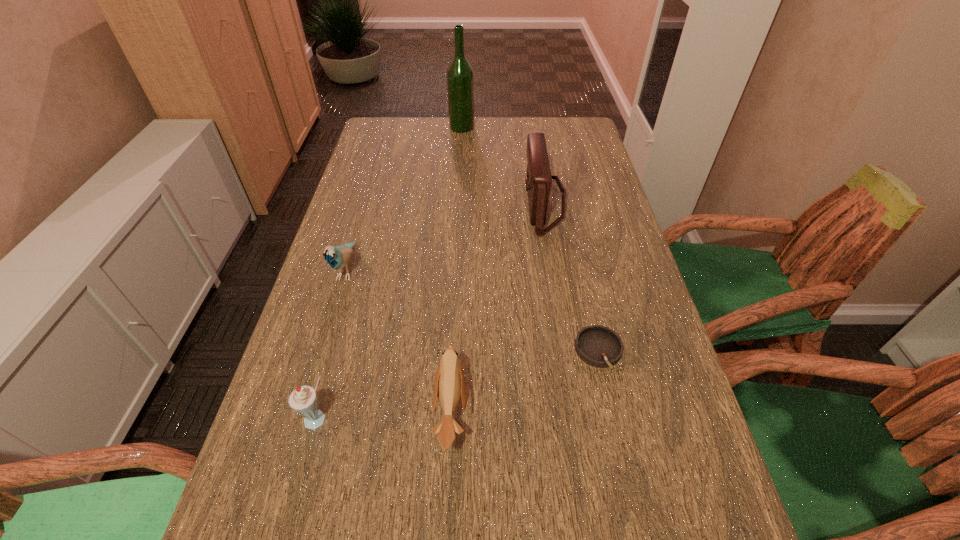
This screenshot has height=540, width=960. Find the location of `free space that is in between the shortest object and the farther bird`. free space that is in between the shortest object and the farther bird is located at coordinates (472, 310).

Locate an element on the screen. vacant space that's between the taller bird and the shortest object is located at coordinates (472, 310).

The width and height of the screenshot is (960, 540). In order to click on unoccupied position between the shortest object and the shoulder bag in this screenshot , I will do `click(571, 277)`.

What are the coordinates of `vacant area between the second farthest object and the milkshake` in the screenshot? It's located at (431, 311).

Where is `unoccupied area between the shoulder bag and the second shortest object`? unoccupied area between the shoulder bag and the second shortest object is located at coordinates (497, 307).

Image resolution: width=960 pixels, height=540 pixels. What are the coordinates of `free space between the nearer bird and the farthest object` in the screenshot? It's located at (457, 269).

Identify which object is the fifth closest to the taller bird. Please provide its 2D coordinates. Your answer should be formatted as a tuple, i.e. [(x, y)], where the tuple contains the x and y coordinates of a point satisfying the conditions above.

[(460, 77)]

Locate an element on the screen. This screenshot has width=960, height=540. object that is the fifth closest one to the milkshake is located at coordinates (460, 77).

The image size is (960, 540). Find the location of `free space that satisfies the following two spatial constraints: 1. on the front flap of the ashtray; 2. on the right side of the shoulder bag`. free space that satisfies the following two spatial constraints: 1. on the front flap of the ashtray; 2. on the right side of the shoulder bag is located at coordinates (568, 351).

Identify the location of vacant position in the image that satisfies the following two spatial constraints: 1. at the beak of the fifth tallest object; 2. on the straw side of the milkshake. (451, 420).